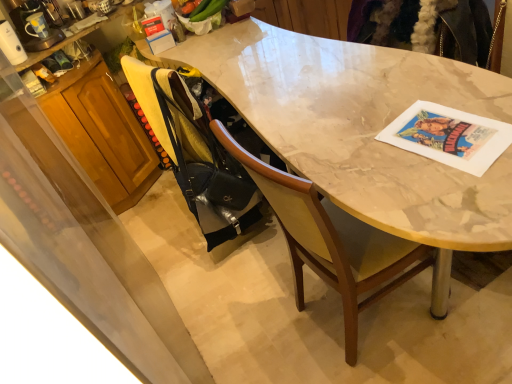
Where is `vacant area situated below black matte handbag at lower left (from a real-world perspective)`? Image resolution: width=512 pixels, height=384 pixels. vacant area situated below black matte handbag at lower left (from a real-world perspective) is located at coordinates (240, 259).